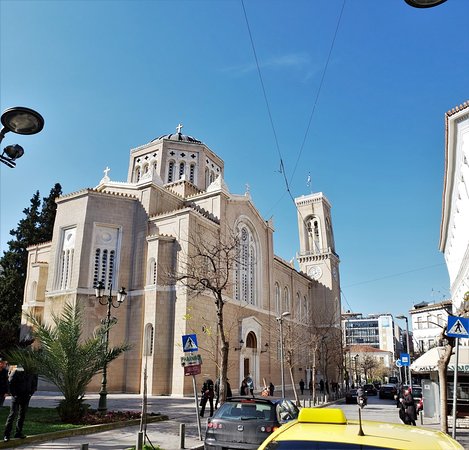
The height and width of the screenshot is (450, 469). What are the coordinates of `door` in the screenshot? It's located at (247, 371).